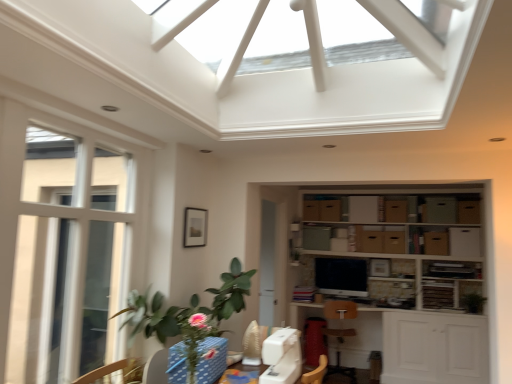
Question: Looking at their shapes, would you say white glossy exhaust hood at upper center is wider or thinner than white plastic swivel chair at center?

Choices:
 (A) wide
 (B) thin

Answer: (A)

Question: From a real-world perspective, relative to white plastic swivel chair at center, is white glossy exhaust hood at upper center vertically above or below?

Choices:
 (A) above
 (B) below

Answer: (A)

Question: Considering the real-world distances, which object is farthest from the white glossy exhaust hood at upper center?

Choices:
 (A) brown cardboard cabinet at center-right, arranged as the first cabinetry when ordered from the bottom
 (B) white plastic swivel chair at center
 (C) blue polka dot fabric at lower center
 (D) wooden armchair at center
 (E) green leafy plant at lower left

Answer: (D)

Question: Which of these objects is positioned closest to the green leafy plant at right?

Choices:
 (A) white glossy exhaust hood at upper center
 (B) green leafy plant at lower left
 (C) white plastic swivel chair at center
 (D) wooden shelves at center
 (E) brown cardboard cabinet at upper center, placed as the 1th cabinetry when sorted from top to bottom

Answer: (D)